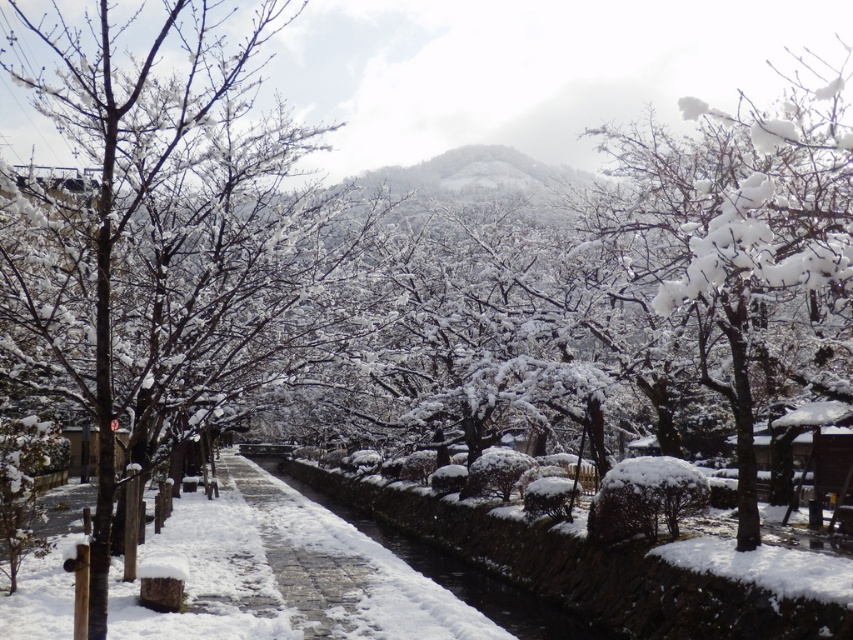
Between snow-covered branches at center and snow-covered stone waterway at center, which one appears on the right side from the viewer's perspective?

From the viewer's perspective, snow-covered stone waterway at center appears more on the right side.

Image resolution: width=853 pixels, height=640 pixels. Describe the element at coordinates (160, 237) in the screenshot. I see `snow-covered branches at center` at that location.

The height and width of the screenshot is (640, 853). In order to click on snow-covered branches at center in this screenshot , I will do `click(160, 237)`.